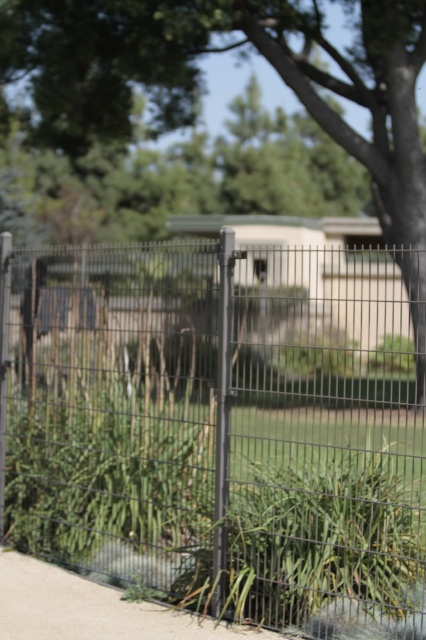
You are standing in front of the image and want to know which object is more to the left between the black wire mesh fence at center and the green leafy tree at upper center. Can you tell me?

The black wire mesh fence at center is positioned on the left side of green leafy tree at upper center, so the black wire mesh fence at center is more to the left.

You are a bird flying over a park and want to land on the tallest object between the black wire mesh fence at center and the green leafy tree at upper center. Which one should you choose?

The green leafy tree at upper center is taller than the black wire mesh fence at center, so you should choose the green leafy tree at upper center to land on.